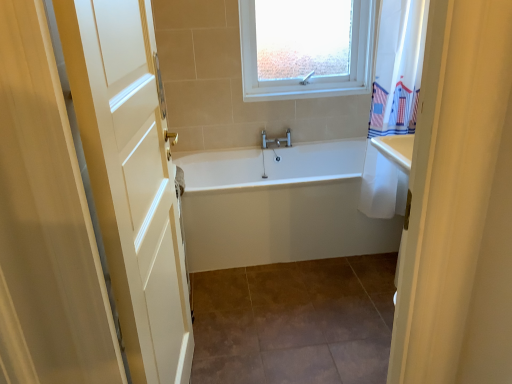
Question: Can white wood door at left be found inside brown tile at center?

Choices:
 (A) yes
 (B) no

Answer: (B)

Question: Can you confirm if brown tile at center is positioned to the left of white wood door at left?

Choices:
 (A) yes
 (B) no

Answer: (B)

Question: Does brown tile at center touch white wood door at left?

Choices:
 (A) yes
 (B) no

Answer: (B)

Question: From the image's perspective, would you say brown tile at center is positioned over white wood door at left?

Choices:
 (A) no
 (B) yes

Answer: (A)

Question: Is brown tile at center oriented towards white wood door at left?

Choices:
 (A) no
 (B) yes

Answer: (A)

Question: Choose the correct answer: Is brown tile at center inside white wood door at left or outside it?

Choices:
 (A) inside
 (B) outside

Answer: (B)

Question: Considering the positions of brown tile at center and white wood door at left in the image, is brown tile at center bigger or smaller than white wood door at left?

Choices:
 (A) small
 (B) big

Answer: (A)

Question: Considering the positions of brown tile at center and white wood door at left in the image, is brown tile at center wider or thinner than white wood door at left?

Choices:
 (A) wide
 (B) thin

Answer: (A)

Question: Is brown tile at center taller or shorter than white wood door at left?

Choices:
 (A) tall
 (B) short

Answer: (B)

Question: From a real-world perspective, is white plastic window at upper center above or below white glossy bathtub at center?

Choices:
 (A) above
 (B) below

Answer: (A)

Question: Is white plastic window at upper center to the left or to the right of white glossy bathtub at center in the image?

Choices:
 (A) left
 (B) right

Answer: (B)

Question: In terms of width, does white plastic window at upper center look wider or thinner when compared to white glossy bathtub at center?

Choices:
 (A) thin
 (B) wide

Answer: (A)

Question: Is white plastic window at upper center bigger or smaller than white glossy bathtub at center?

Choices:
 (A) small
 (B) big

Answer: (A)

Question: In the image, is white glossy bathtub at center on the left side or the right side of white wood door at left?

Choices:
 (A) left
 (B) right

Answer: (B)

Question: Choose the correct answer: Is white glossy bathtub at center inside white wood door at left or outside it?

Choices:
 (A) inside
 (B) outside

Answer: (B)